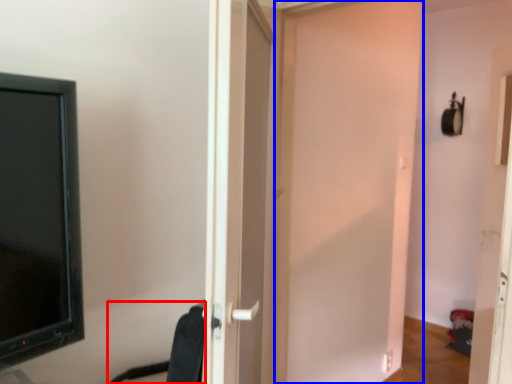
Question: Which of the following is the farthest to the observer, swivel chair (highlighted by a red box) or door (highlighted by a blue box)?

Choices:
 (A) swivel chair
 (B) door

Answer: (B)